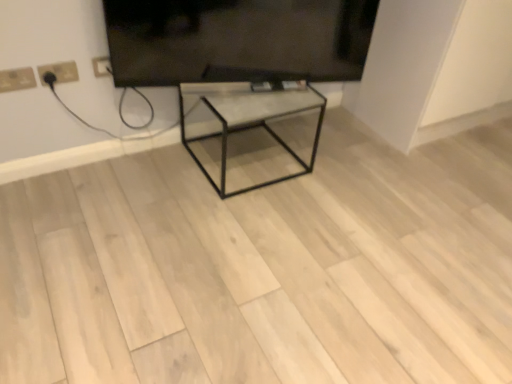
Question: Is white plastic socket at upper left, the first electric outlet in the right-to-left sequence, not inside metallic glass table at center?

Choices:
 (A) yes
 (B) no

Answer: (A)

Question: Can you confirm if white plastic socket at upper left, positioned as the second electric outlet in left-to-right order, is positioned to the left of metallic glass table at center?

Choices:
 (A) yes
 (B) no

Answer: (A)

Question: From the image's perspective, is white plastic socket at upper left, the first electric outlet in the right-to-left sequence, located above metallic glass table at center?

Choices:
 (A) yes
 (B) no

Answer: (A)

Question: Can you confirm if white plastic socket at upper left, the first electric outlet in the right-to-left sequence, is smaller than metallic glass table at center?

Choices:
 (A) yes
 (B) no

Answer: (A)

Question: Could you tell me if white plastic socket at upper left, the first electric outlet in the right-to-left sequence, is facing metallic glass table at center?

Choices:
 (A) no
 (B) yes

Answer: (A)

Question: Is metallic glass table at center at the back of white plastic socket at upper left, the first electric outlet in the right-to-left sequence?

Choices:
 (A) no
 (B) yes

Answer: (A)

Question: Is black glossy tv at upper center next to white plastic socket at upper left, positioned as the second electric outlet in left-to-right order?

Choices:
 (A) yes
 (B) no

Answer: (B)

Question: Considering the relative sizes of black glossy tv at upper center and white plastic socket at upper left, positioned as the second electric outlet in left-to-right order, in the image provided, is black glossy tv at upper center bigger than white plastic socket at upper left, positioned as the second electric outlet in left-to-right order,?

Choices:
 (A) yes
 (B) no

Answer: (A)

Question: Is black glossy tv at upper center smaller than white plastic socket at upper left, positioned as the second electric outlet in left-to-right order?

Choices:
 (A) yes
 (B) no

Answer: (B)

Question: Considering the relative positions of black glossy tv at upper center and white plastic socket at upper left, positioned as the second electric outlet in left-to-right order, in the image provided, is black glossy tv at upper center in front of white plastic socket at upper left, positioned as the second electric outlet in left-to-right order,?

Choices:
 (A) no
 (B) yes

Answer: (B)

Question: From the image's perspective, is black glossy tv at upper center over white plastic socket at upper left, the first electric outlet in the right-to-left sequence?

Choices:
 (A) no
 (B) yes

Answer: (B)

Question: Is black glossy tv at upper center facing away from white plastic socket at upper left, positioned as the second electric outlet in left-to-right order?

Choices:
 (A) no
 (B) yes

Answer: (A)

Question: From a real-world perspective, is white plastic socket at upper left, the first electric outlet in the right-to-left sequence, located higher than white plastic electric outlet at upper left, which appears as the 1th electric outlet when viewed from the left?

Choices:
 (A) no
 (B) yes

Answer: (A)